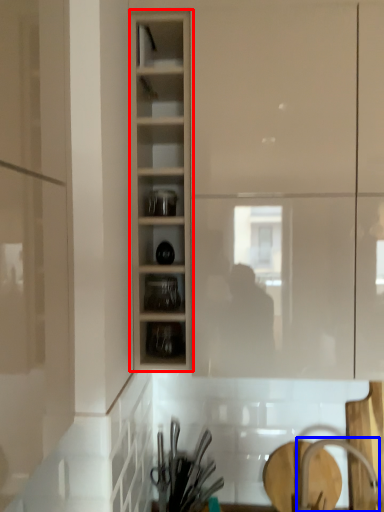
Question: Which point is closer to the camera, cabinetry (highlighted by a red box) or faucet (highlighted by a blue box)?

Choices:
 (A) cabinetry
 (B) faucet

Answer: (A)